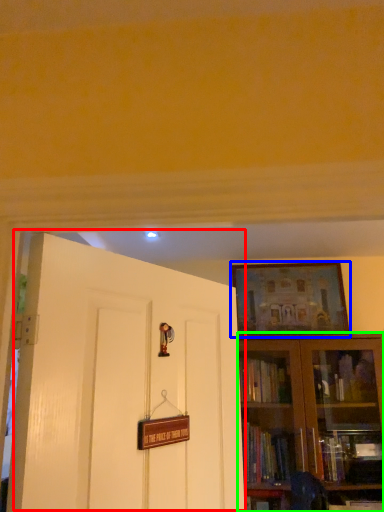
Question: Which object is the closest to the door (highlighted by a red box)? Choose among these: picture frame (highlighted by a blue box) or bookcase (highlighted by a green box).

Choices:
 (A) picture frame
 (B) bookcase

Answer: (B)